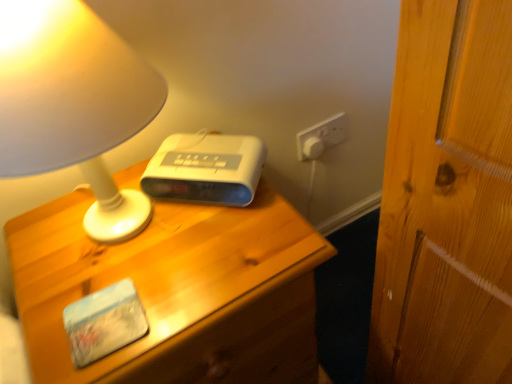
Locate an element on the screen. The width and height of the screenshot is (512, 384). vacant space in front of white plastic alarm clock at center is located at coordinates (200, 246).